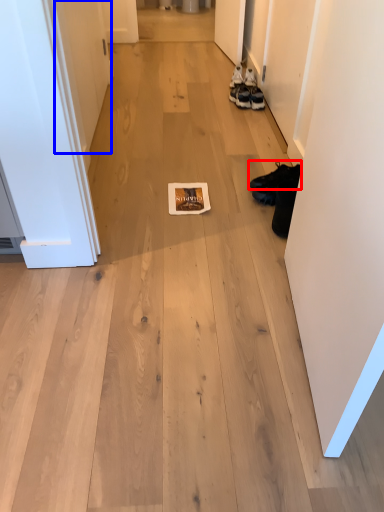
Question: Which of the following is the farthest to the observer, footwear (highlighted by a red box) or door (highlighted by a blue box)?

Choices:
 (A) footwear
 (B) door

Answer: (A)